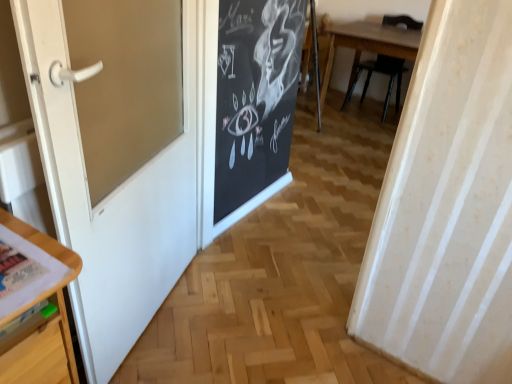
Identify the location of wooden chair at upper right. This screenshot has height=384, width=512. (380, 73).

What do you see at coordinates (380, 73) in the screenshot? I see `wooden chair at upper right` at bounding box center [380, 73].

What is the approximate height of white glossy door at left?

The height of white glossy door at left is 1.25 meters.

Measure the distance between point [96,207] and camera.

The depth of point [96,207] is 1.22 meters.

Find the location of a particular element. The width and height of the screenshot is (512, 384). white glossy door at left is located at coordinates (111, 198).

Consider the image. What is the approximate width of white glossy door at left?

The width of white glossy door at left is 4.46 inches.

Describe the element at coordinates (111, 198) in the screenshot. I see `white glossy door at left` at that location.

Locate an element on the screen. This screenshot has width=512, height=384. wooden chair at upper right is located at coordinates (380, 73).

In the scene shown: Which is more to the right, white glossy door at left or wooden chair at upper right?

From the viewer's perspective, wooden chair at upper right appears more on the right side.

Considering their positions, is white glossy door at left located in front of or behind wooden chair at upper right?

Visually, white glossy door at left is located in front of wooden chair at upper right.

Considering the points (129, 261) and (412, 31), which point is in front, point (129, 261) or point (412, 31)?

The point (129, 261) is more forward.

From the image's perspective, between white glossy door at left and wooden chair at upper right, who is located below?

white glossy door at left.

From a real-world perspective, is white glossy door at left below wooden chair at upper right?

Actually, white glossy door at left is physically above wooden chair at upper right in the real world.

Between white glossy door at left and wooden chair at upper right, which one has smaller width?

white glossy door at left is thinner.

Is white glossy door at left shorter than wooden chair at upper right?

Incorrect, the height of white glossy door at left does not fall short of that of wooden chair at upper right.

In the scene shown: Between white glossy door at left and wooden chair at upper right, which one has larger size?

Bigger between the two is wooden chair at upper right.

Is white glossy door at left positioned beyond the bounds of wooden chair at upper right?

Absolutely, white glossy door at left is external to wooden chair at upper right.

Is there a large distance between white glossy door at left and wooden chair at upper right?

Indeed, white glossy door at left is not near wooden chair at upper right.

Is white glossy door at left oriented away from wooden chair at upper right?

That's not correct — white glossy door at left is not looking away from wooden chair at upper right.

How many degrees apart are the facing directions of white glossy door at left and wooden chair at upper right?

The facing directions of white glossy door at left and wooden chair at upper right are 107 degrees apart.

How distant is white glossy door at left from wooden chair at upper right?

white glossy door at left and wooden chair at upper right are 3.02 meters apart.

Locate an element on the screen. This screenshot has width=512, height=384. chair located on the right of white glossy door at left is located at coordinates (380, 73).

Which object is positioned more to the left, wooden chair at upper right or white glossy door at left?

From the viewer's perspective, white glossy door at left appears more on the left side.

Considering their positions, is wooden chair at upper right located in front of or behind white glossy door at left?

In the image, wooden chair at upper right appears behind white glossy door at left.

Is point (393, 19) farther from viewer compared to point (190, 76)?

Yes, point (393, 19) is farther from viewer.

Consider the image. From the image's perspective, is wooden chair at upper right above white glossy door at left?

Yes, from the image's perspective, wooden chair at upper right is above white glossy door at left.

From a real-world perspective, is wooden chair at upper right positioned under white glossy door at left based on gravity?

Yes, from a real-world perspective, wooden chair at upper right is under white glossy door at left.

Consider the image. Is wooden chair at upper right wider than white glossy door at left?

Indeed, wooden chair at upper right has a greater width compared to white glossy door at left.

In the scene shown: Considering the sizes of objects wooden chair at upper right and white glossy door at left in the image provided, who is taller, wooden chair at upper right or white glossy door at left?

white glossy door at left is taller.

Consider the image. Between wooden chair at upper right and white glossy door at left, which one has larger size?

Bigger between the two is wooden chair at upper right.

Is white glossy door at left completely or partially inside wooden chair at upper right?

Actually, white glossy door at left is outside wooden chair at upper right.

Is wooden chair at upper right touching white glossy door at left?

wooden chair at upper right and white glossy door at left are not in contact.

In the scene shown: Is wooden chair at upper right turned away from white glossy door at left?

wooden chair at upper right does not have its back to white glossy door at left.

How different are the orientations of wooden chair at upper right and white glossy door at left in degrees?

They differ by 107 degrees in their facing directions.

In order to click on chair below the white glossy door at left (from a real-world perspective) in this screenshot , I will do `click(380, 73)`.

This screenshot has height=384, width=512. In order to click on door in front of the wooden chair at upper right in this screenshot , I will do `click(111, 198)`.

Identify the location of chair behind the white glossy door at left. pyautogui.click(x=380, y=73).